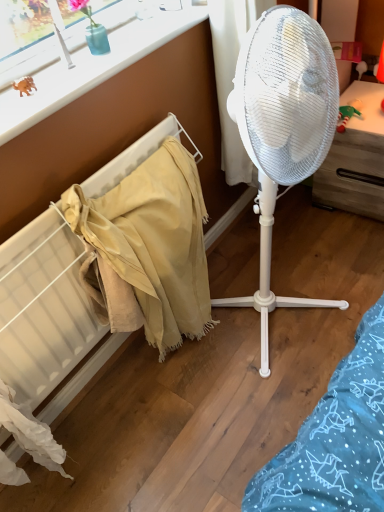
Identify the location of free point to the right of rubber orange dinosaur at upper left. (69, 81).